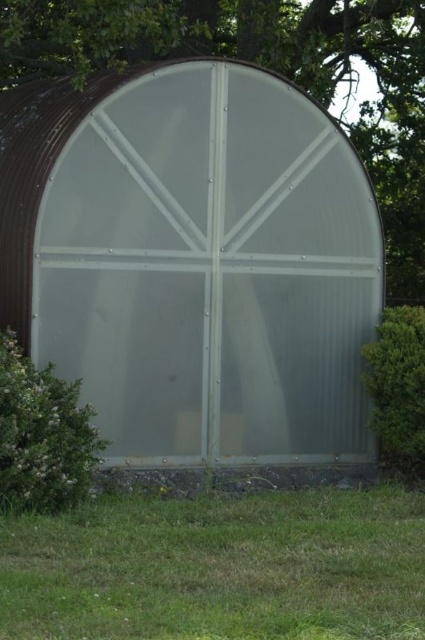
Is green leafy hedge at lower left thinner than green leafy hedge at right?

No.

Which is above, green leafy hedge at lower left or green leafy hedge at right?

A: green leafy hedge at right

Which is in front, point (36, 481) or point (421, 400)?

Point (36, 481) is more forward.

Where is `green leafy hedge at lower left`? The width and height of the screenshot is (425, 640). green leafy hedge at lower left is located at coordinates (42, 435).

Does point (5, 13) lie in front of point (421, 433)?

No.

Can you confirm if green corrugated metal at center is positioned above green leafy hedge at right?

Yes, green corrugated metal at center is above green leafy hedge at right.

Between point (132, 13) and point (379, 369), which one is positioned in front?

Point (132, 13)

Locate an element on the screen. Image resolution: width=425 pixels, height=640 pixels. green corrugated metal at center is located at coordinates (269, 67).

Does green grass at lower center come in front of green leafy hedge at right?

Yes.

Does green grass at lower center have a larger size compared to green leafy hedge at right?

Correct, green grass at lower center is larger in size than green leafy hedge at right.

Is point (317, 637) less distant than point (393, 332)?

Yes, it is.

In order to click on green grass at lower center in this screenshot , I will do `click(218, 566)`.